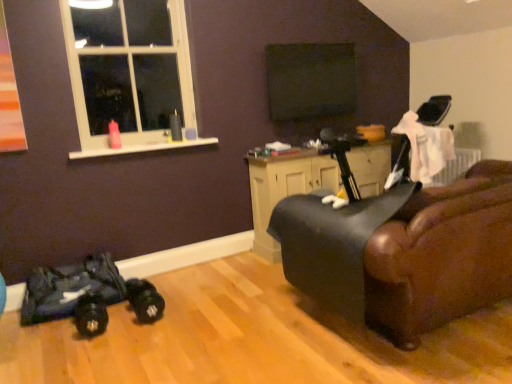
Question: Is matte black cabinet at center touching black leather swivel chair at right?

Choices:
 (A) no
 (B) yes

Answer: (A)

Question: Is matte black cabinet at center to the right of black leather swivel chair at right from the viewer's perspective?

Choices:
 (A) no
 (B) yes

Answer: (B)

Question: Is matte black cabinet at center not within black leather swivel chair at right?

Choices:
 (A) no
 (B) yes

Answer: (B)

Question: Does matte black cabinet at center have a smaller size compared to black leather swivel chair at right?

Choices:
 (A) no
 (B) yes

Answer: (A)

Question: Is black leather swivel chair at right at the back of matte black cabinet at center?

Choices:
 (A) yes
 (B) no

Answer: (B)

Question: From the image's perspective, is black leather swivel chair at right above or below matte black cabinet at center?

Choices:
 (A) above
 (B) below

Answer: (B)

Question: From a real-world perspective, is black leather swivel chair at right physically located above or below matte black cabinet at center?

Choices:
 (A) above
 (B) below

Answer: (A)

Question: Is black leather swivel chair at right inside the boundaries of matte black cabinet at center, or outside?

Choices:
 (A) inside
 (B) outside

Answer: (B)

Question: Considering their positions, is black leather swivel chair at right located in front of or behind matte black cabinet at center?

Choices:
 (A) front
 (B) behind

Answer: (A)

Question: Is matte black cabinet at center to the left or to the right of black matte screen at upper center in the image?

Choices:
 (A) left
 (B) right

Answer: (B)

Question: Considering their positions, is matte black cabinet at center located in front of or behind black matte screen at upper center?

Choices:
 (A) behind
 (B) front

Answer: (B)

Question: Is point (333, 178) closer or farther from the camera than point (309, 94)?

Choices:
 (A) closer
 (B) farther

Answer: (A)

Question: In terms of height, does matte black cabinet at center look taller or shorter compared to black matte screen at upper center?

Choices:
 (A) tall
 (B) short

Answer: (A)

Question: Is point (396, 205) closer or farther from the camera than point (310, 72)?

Choices:
 (A) closer
 (B) farther

Answer: (A)

Question: Would you say black leather swivel chair at right is to the left or to the right of black matte screen at upper center in the picture?

Choices:
 (A) right
 (B) left

Answer: (B)